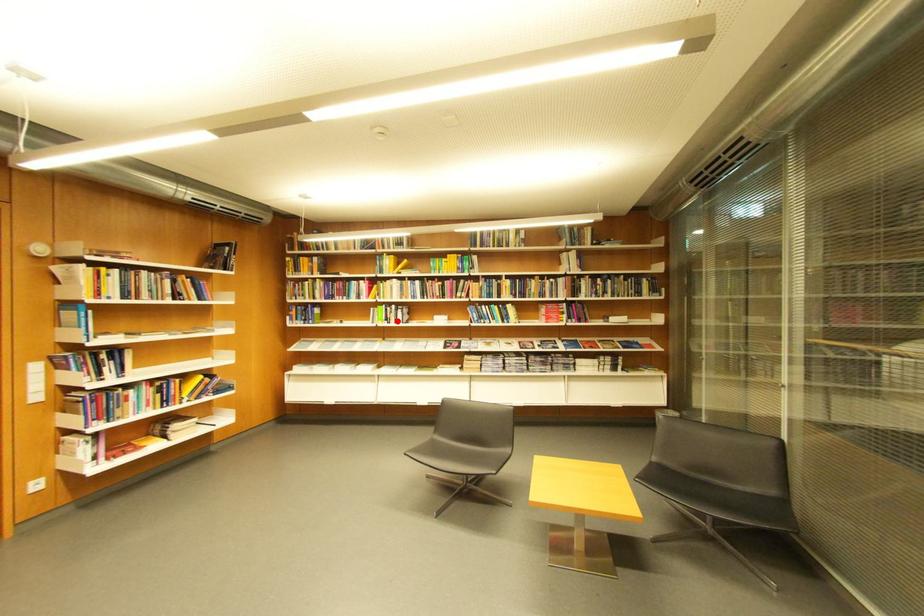
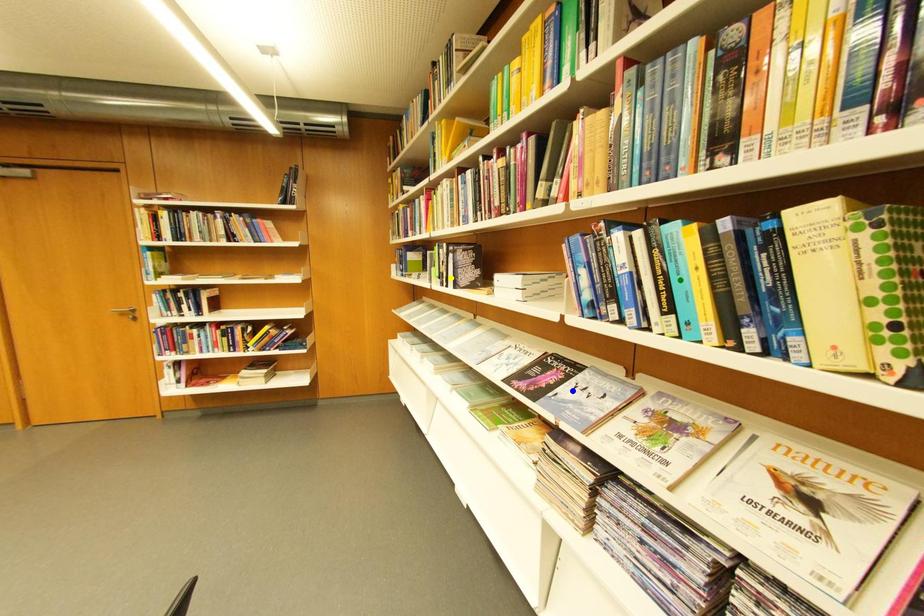
Question: I am providing you with two images of the same scene from different viewpoints. A red point is marked on the first image. You are given multiple points on the second image. Which point in image 2 is actually the same real-world point as the red point in image 1?

Choices:
 (A) blue point
 (B) green point
 (C) yellow point

Answer: (C)